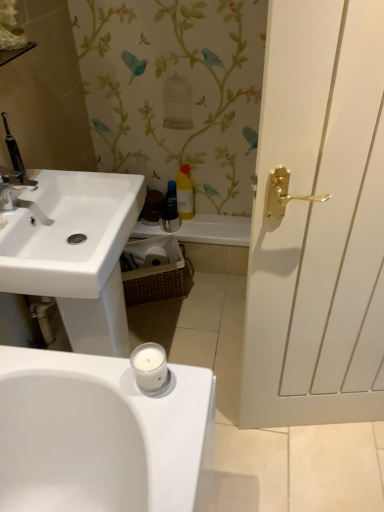
At what (x,y) coordinates should I click in order to perform the action: click on vacant area on the back side of matte silver faucet at upper left. Please return your answer as a coordinate pair (x, y). This screenshot has height=512, width=384. Looking at the image, I should click on (33, 186).